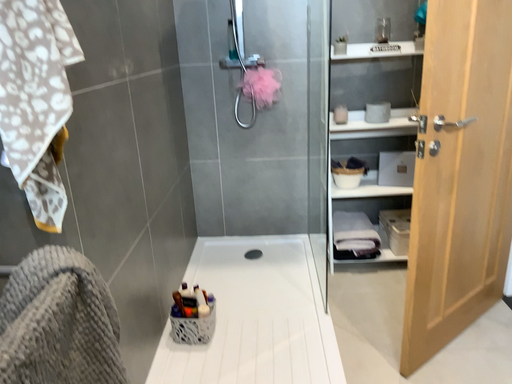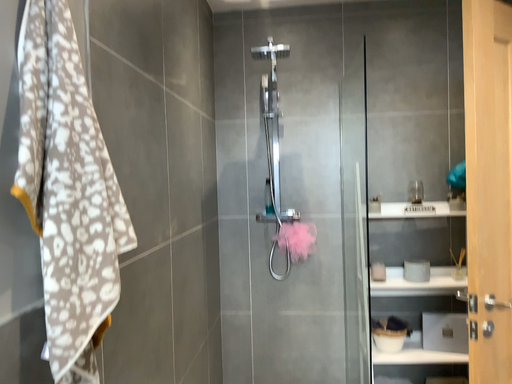
Question: How did the camera likely rotate when shooting the video?

Choices:
 (A) rotated downward
 (B) rotated upward

Answer: (B)